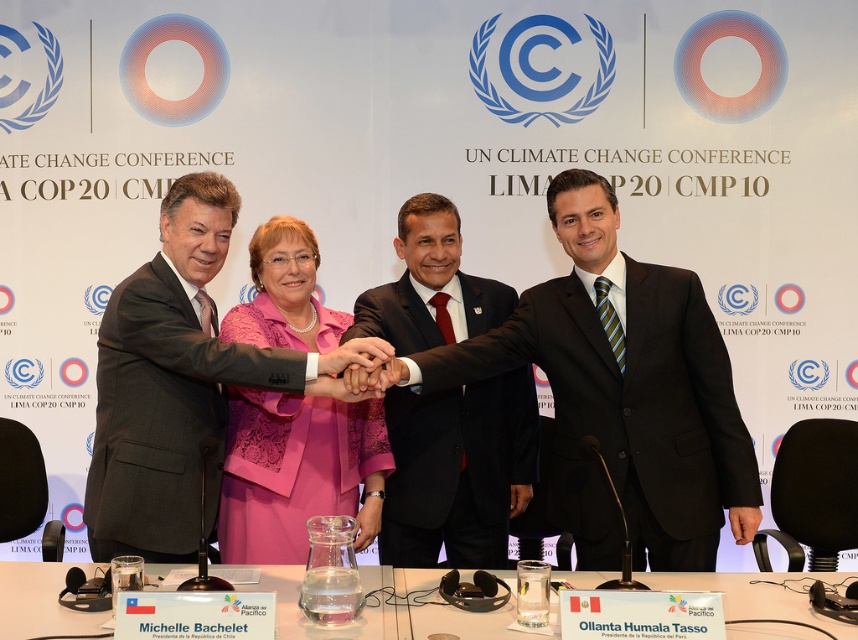
Question: Is pink lace dress at center below clear plastic water at lower center?

Choices:
 (A) no
 (B) yes

Answer: (A)

Question: Which object is positioned closest to the pink lace dress at center?

Choices:
 (A) black suit at center
 (B) clear plastic water at lower center
 (C) smooth skin hand at center

Answer: (A)

Question: Is matte black suit at center below black suit at center?

Choices:
 (A) no
 (B) yes

Answer: (B)

Question: Which point is closer to the camera?

Choices:
 (A) (373, 436)
 (B) (732, 595)
 (C) (721, 502)

Answer: (B)

Question: Which point appears closest to the camera in this image?

Choices:
 (A) (553, 326)
 (B) (765, 624)
 (C) (464, 404)
 (D) (343, 312)

Answer: (B)

Question: Can you confirm if clear plastic water at lower center is positioned below smooth skin hand at center?

Choices:
 (A) no
 (B) yes

Answer: (B)